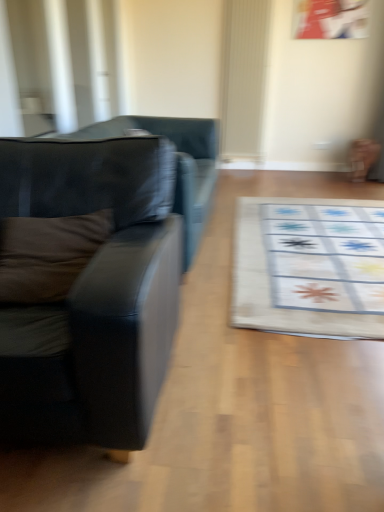
Question: Based on their sizes in the image, would you say black leather couch at left, which is the 1th studio couch in front-to-back order, is bigger or smaller than brown fabric pillow at left?

Choices:
 (A) small
 (B) big

Answer: (B)

Question: From a real-world perspective, is black leather couch at left, placed as the 2th studio couch when sorted from back to front, positioned above or below brown fabric pillow at left?

Choices:
 (A) above
 (B) below

Answer: (B)

Question: Which object is the farthest from the white fabric mat at center?

Choices:
 (A) black leather couch at left, which is the 1th studio couch in front-to-back order
 (B) matte black couch at left, which ranks as the 2th studio couch in front-to-back order
 (C) brown fabric pillow at left

Answer: (C)

Question: Which of these objects is positioned farthest from the matte black couch at left, which ranks as the 2th studio couch in front-to-back order?

Choices:
 (A) black leather couch at left, which is the 1th studio couch in front-to-back order
 (B) brown fabric pillow at left
 (C) white fabric mat at center

Answer: (B)